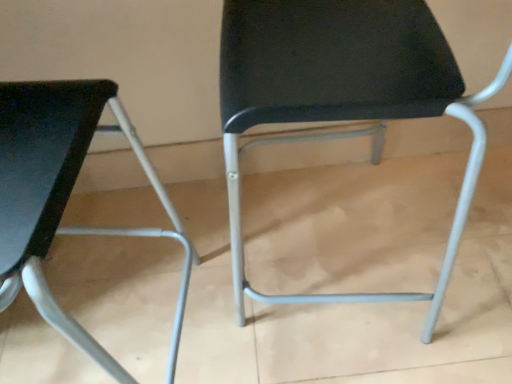
Question: Choose the correct answer: Is matte black chair at left, which ranks as the first chair in left-to-right order, inside black fabric chair at center, acting as the 2th chair starting from the left, or outside it?

Choices:
 (A) inside
 (B) outside

Answer: (B)

Question: In terms of height, does matte black chair at left, the 2th chair in the right-to-left sequence, look taller or shorter compared to black fabric chair at center, the 1th chair from the right?

Choices:
 (A) short
 (B) tall

Answer: (B)

Question: Is matte black chair at left, which ranks as the first chair in left-to-right order, wider or thinner than black fabric chair at center, the 1th chair from the right?

Choices:
 (A) wide
 (B) thin

Answer: (A)

Question: Relative to matte black chair at left, the 2th chair in the right-to-left sequence, is black fabric chair at center, the 1th chair from the right, in front or behind?

Choices:
 (A) front
 (B) behind

Answer: (B)

Question: Based on their positions, is black fabric chair at center, acting as the 2th chair starting from the left, located to the left or right of matte black chair at left, which ranks as the first chair in left-to-right order?

Choices:
 (A) left
 (B) right

Answer: (B)

Question: From a real-world perspective, is black fabric chair at center, the 1th chair from the right, positioned above or below matte black chair at left, the 2th chair in the right-to-left sequence?

Choices:
 (A) below
 (B) above

Answer: (A)

Question: In terms of size, does black fabric chair at center, the 1th chair from the right, appear bigger or smaller than matte black chair at left, which ranks as the first chair in left-to-right order?

Choices:
 (A) small
 (B) big

Answer: (A)